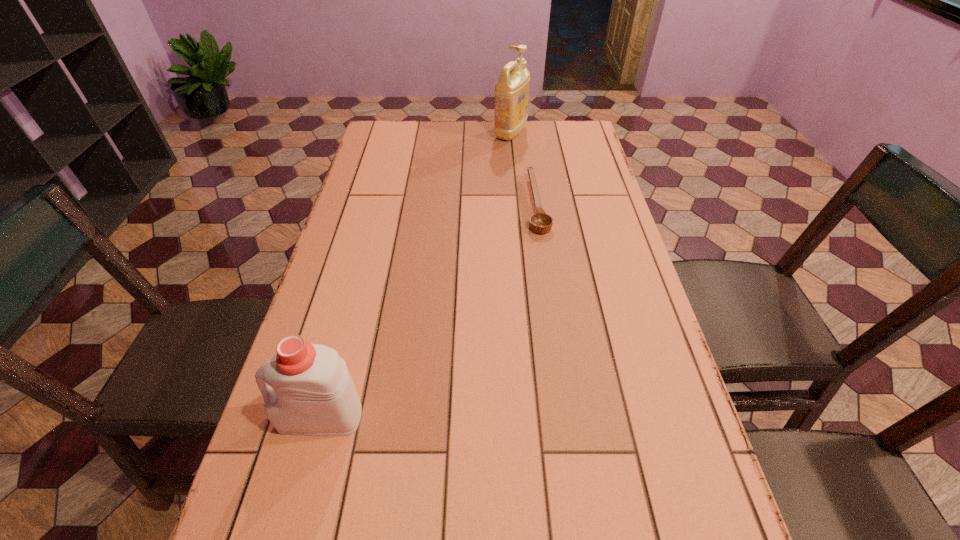
The height and width of the screenshot is (540, 960). In order to click on vacant space at the far edge of the desktop in this screenshot , I will do `click(446, 144)`.

This screenshot has height=540, width=960. In order to click on free space at the left edge of the desktop in this screenshot , I will do `click(313, 332)`.

Find the location of a particular element. The image size is (960, 540). vacant space at the right edge is located at coordinates (658, 375).

The image size is (960, 540). Identify the location of free region at the far right corner. (556, 145).

Where is `vacant space in between the left detergent and the shortest object`? vacant space in between the left detergent and the shortest object is located at coordinates (429, 310).

This screenshot has height=540, width=960. In order to click on vacant point located between the farthest object and the shortest object in this screenshot , I will do `click(523, 168)`.

At what (x,y) coordinates should I click in order to perform the action: click on free space between the nearer detergent and the shortest object. Please return your answer as a coordinate pair (x, y). The image size is (960, 540). Looking at the image, I should click on (429, 310).

Find the location of a particular element. This screenshot has width=960, height=540. free spot between the shortest object and the tallest object is located at coordinates (523, 168).

The image size is (960, 540). I want to click on free space between the farther detergent and the shortest object, so click(x=523, y=168).

The height and width of the screenshot is (540, 960). What are the coordinates of `object that is the closest one to the wooden spoon` in the screenshot? It's located at [x=511, y=91].